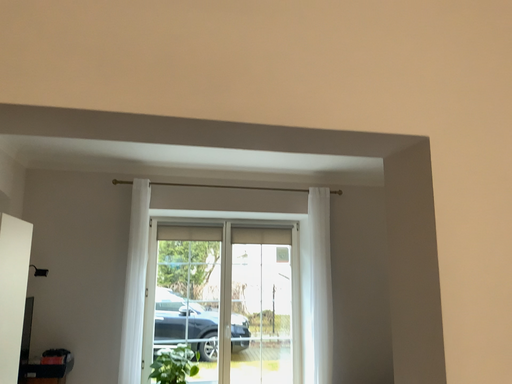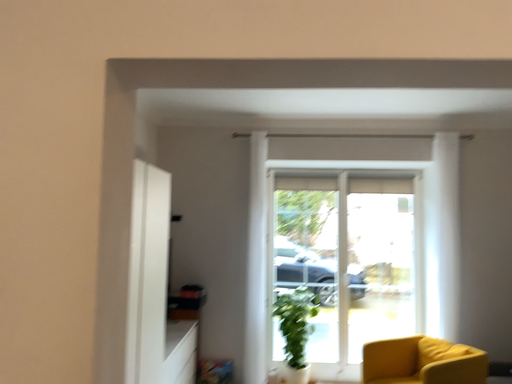
Question: Which way did the camera rotate in the video?

Choices:
 (A) rotated left
 (B) rotated right

Answer: (A)